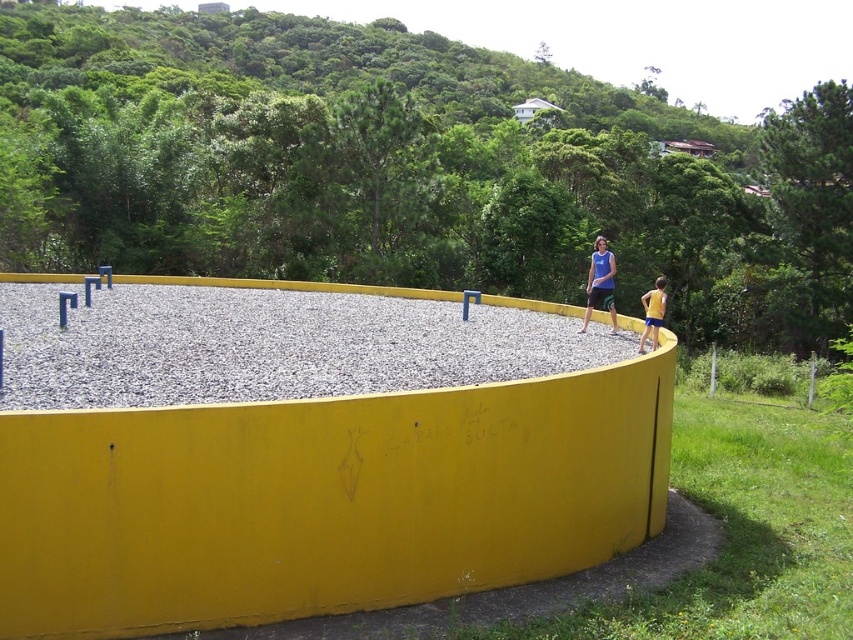
You are a photographer trying to capture a person wearing a blue fabric shirt at center and yellow fabric shorts at right. Which piece of clothing will appear taller in the photo?

The blue fabric shirt at center appears taller than the yellow fabric shorts at right in the photo because the blue fabric shirt at center has a greater height compared to the yellow fabric shorts at right.

You are standing in front of the yellow circular structure and looking at two points marked on it. The first point is at coordinate point (19, 403) and the second is at point (608, 284). Which point is closer to you?

Point (19, 403) is closer to the camera than point (608, 284), so the first point is closer to you.

You are standing in the circular yellow structure and want to place both the gray gravel at center and the blue fabric shirt at center. Which object takes up more area?

The blue fabric shirt at center occupies more space than the gray gravel at center, so it takes up more area.